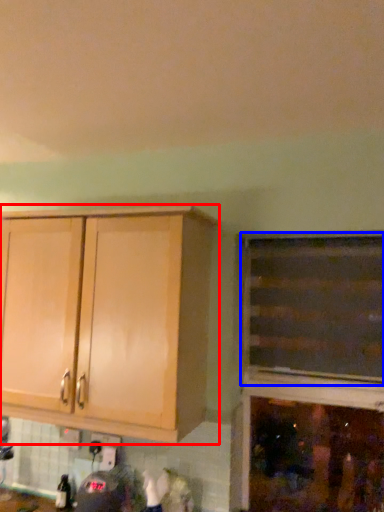
Question: Which point is closer to the camera, cabinetry (highlighted by a red box) or cabinetry (highlighted by a blue box)?

Choices:
 (A) cabinetry
 (B) cabinetry

Answer: (A)